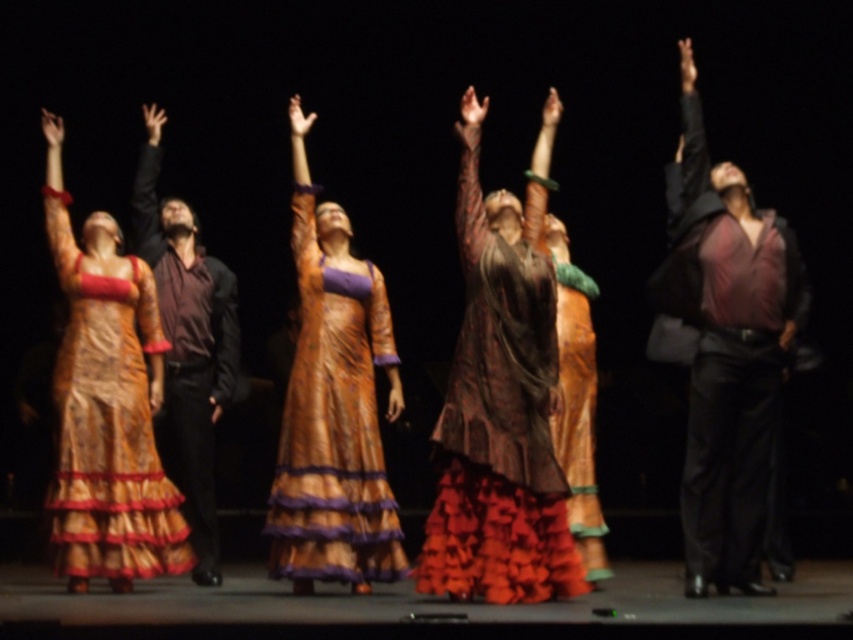
Question: Does matte brown dress at center appear over matte burgundy shirt at center?

Choices:
 (A) no
 (B) yes

Answer: (A)

Question: Can you confirm if matte brown dress at center is positioned above silky gold dress at left?

Choices:
 (A) no
 (B) yes

Answer: (B)

Question: Which point is farther from the camera taking this photo?

Choices:
 (A) (383, 340)
 (B) (450, 419)
 (C) (769, 243)

Answer: (A)

Question: Can you confirm if silky gold dress at left is positioned above shiny gold dress at center?

Choices:
 (A) yes
 (B) no

Answer: (B)

Question: Which object appears farthest from the camera in this image?

Choices:
 (A) matte brown dress at center
 (B) shiny gold dress at center
 (C) silky gold dress at left

Answer: (B)

Question: Which object appears closest to the camera in this image?

Choices:
 (A) matte brown dress at center
 (B) silky gold dress at left

Answer: (A)